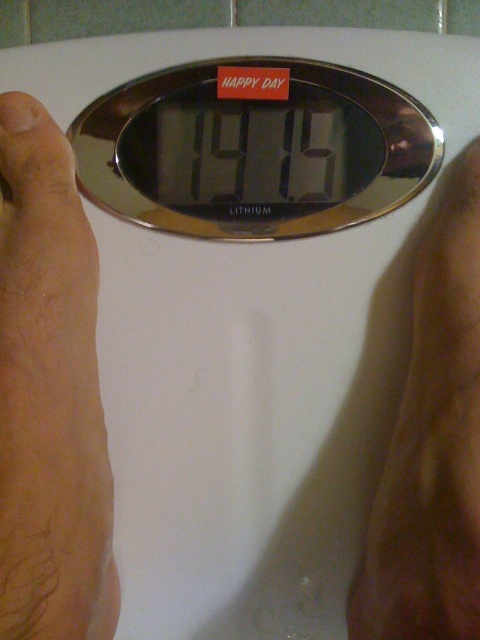
Question: Where is skinny flesh at left located in relation to brown leather hand at lower right in the image?

Choices:
 (A) above
 (B) below

Answer: (A)

Question: Which point appears farthest from the camera in this image?

Choices:
 (A) (x=447, y=358)
 (B) (x=67, y=163)

Answer: (B)

Question: Does skinny flesh at left appear over brown leather hand at lower right?

Choices:
 (A) no
 (B) yes

Answer: (B)

Question: Can you confirm if skinny flesh at left is positioned above brown leather hand at lower right?

Choices:
 (A) yes
 (B) no

Answer: (A)